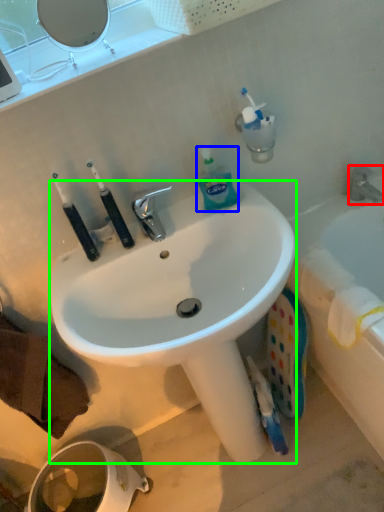
Question: Estimate the real-world distances between objects in this image. Which object is farther from tap (highlighted by a red box), bottle (highlighted by a blue box) or sink (highlighted by a green box)?

Choices:
 (A) bottle
 (B) sink

Answer: (B)